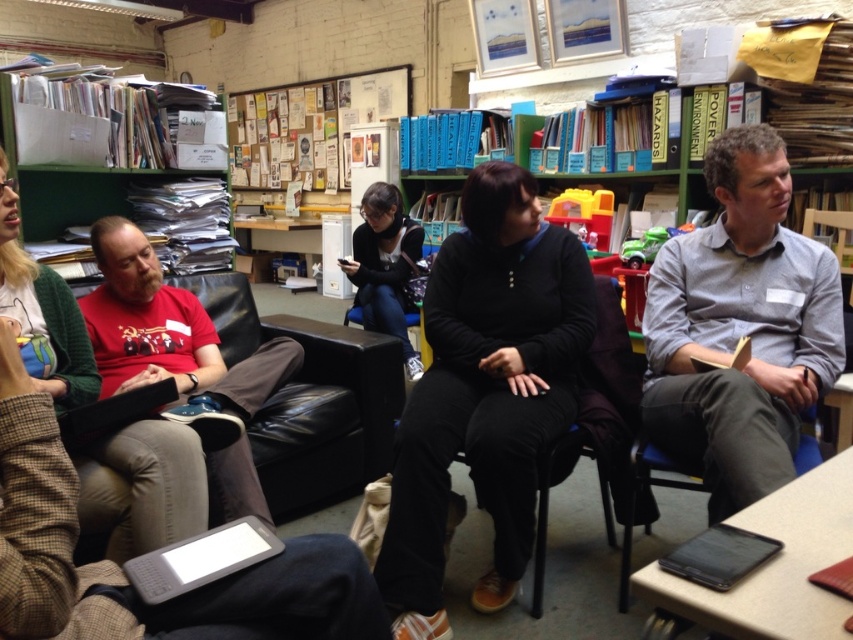
You are organizing a clothing donation drive and need to sort items by size. You have two items in front of you, the black matte sweater at center and the gray cotton shirt at center. Which one should you place in the small size bin?

The black matte sweater at center is smaller than the gray cotton shirt at center, so it should be placed in the small size bin.

You are a person who wants to sit down in the room. You see the black leather armchair at center and the black fabric jacket at center. Which object is located lower?

The black leather armchair at center is located lower than the black fabric jacket at center.

You are organizing a charity clothing drive and need to determine which item takes up more space in the donation box. Based on the image, which is larger between the black matte sweater at center and the black fabric jacket at center?

The black matte sweater at center is bigger than the black fabric jacket at center, so it takes up more space in the donation box.